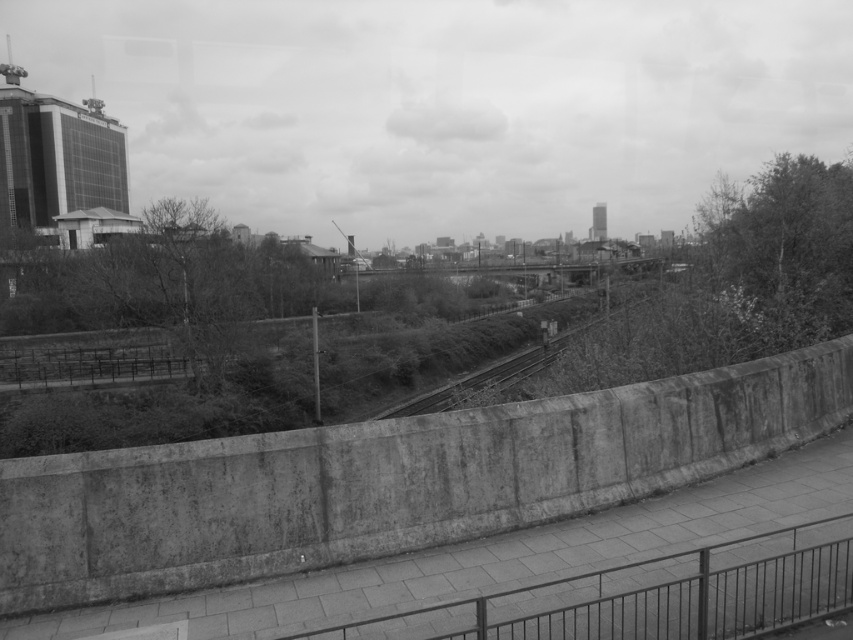
Does point (659, 576) come behind point (404, 404)?

No, it is not.

Which is below, metal/rusty rail at lower center or smooth concrete train track at center?

metal/rusty rail at lower center is lower down.

Between point (621, 618) and point (570, 307), which one is positioned in front?

Positioned in front is point (621, 618).

Identify the location of metal/rusty rail at lower center. Image resolution: width=853 pixels, height=640 pixels. (651, 595).